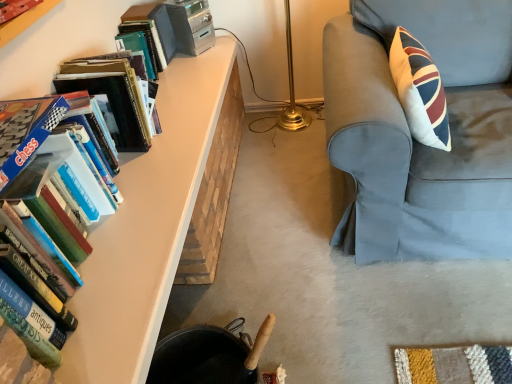
Image resolution: width=512 pixels, height=384 pixels. Find the location of `free region under gold metallic table lamp at center (from a real-world perspective)`. free region under gold metallic table lamp at center (from a real-world perspective) is located at coordinates (303, 136).